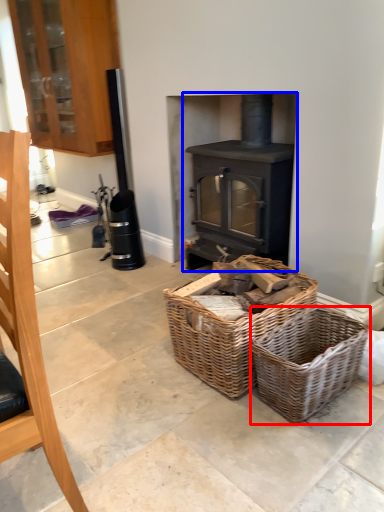
Question: Which point is closer to the camera, basket (highlighted by a red box) or wood burning stove (highlighted by a blue box)?

Choices:
 (A) basket
 (B) wood burning stove

Answer: (A)